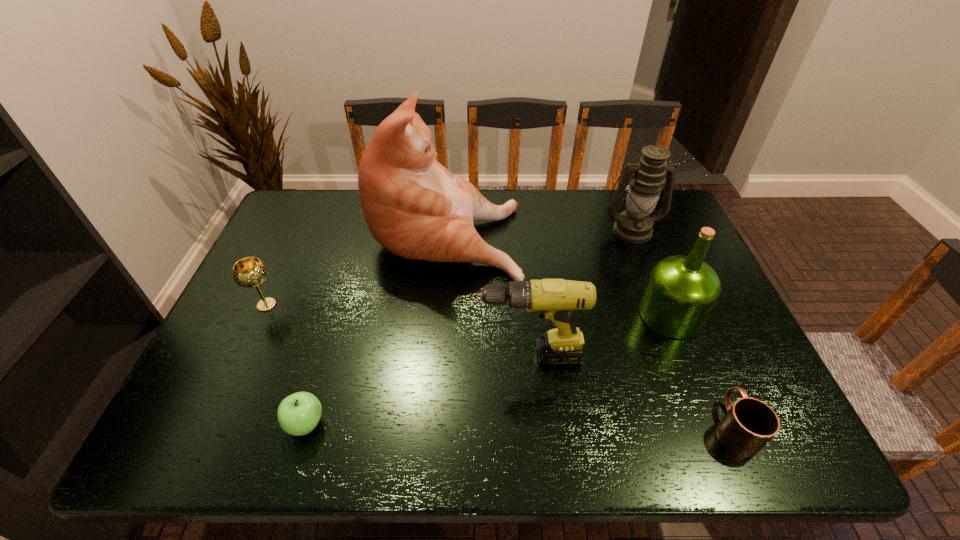
In order to click on free spot located on the left of the olive oil in this screenshot , I will do `click(523, 315)`.

Identify the location of vacant area located 0.230m on the handle side of the drill. (379, 356).

Image resolution: width=960 pixels, height=540 pixels. What are the coordinates of `free point located 0.210m on the handle side of the drill` in the screenshot? It's located at (388, 356).

Where is `free space located on the handle side of the drill`? This screenshot has width=960, height=540. free space located on the handle side of the drill is located at coordinates (426, 356).

Image resolution: width=960 pixels, height=540 pixels. Find the location of `free space located 0.140m on the front of the leftmost object`. free space located 0.140m on the front of the leftmost object is located at coordinates (241, 362).

You are a GUI agent. You are given a task and a screenshot of the screen. Output one action in this format:
    pyautogui.click(x=<x>, y=<y>)
    Task: Click on the free space located 0.340m on the back of the apple
    
    Given the screenshot: What is the action you would take?
    pyautogui.click(x=345, y=292)

I want to click on vacant space situated 0.300m on the side of the mug with the handle, so click(680, 298).

Locate an element on the screen. This screenshot has width=960, height=540. free space located 0.280m on the side of the mug with the handle is located at coordinates (682, 303).

Where is `blank space located on the side of the mug with the handle`? Image resolution: width=960 pixels, height=540 pixels. blank space located on the side of the mug with the handle is located at coordinates (709, 368).

The height and width of the screenshot is (540, 960). I want to click on cat located in the far edge section of the desktop, so click(414, 207).